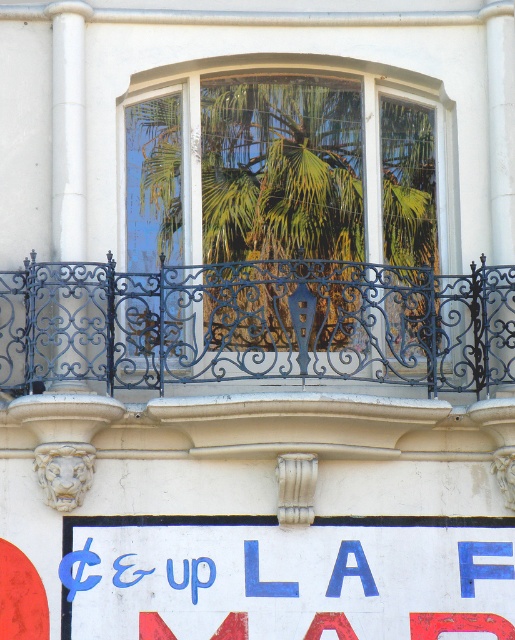
You are standing in front of the building and want to look through the clear glass window at center to see the view outside. However, the black wrought iron balcony at center is blocking your view. Can you move to a position where you can see through the window without obstruction?

The clear glass window at center is positioned over the black wrought iron balcony at center, so if you move to a position slightly above the balcony, you can look through the window without obstruction.

You are an architect reviewing the building facade. You need to determine if the clear glass window at center can accommodate a large painting that requires at least 2 meters in height. The black wrought iron balcony at center is known to be 1.5 meters tall. Can the window fit the painting?

The clear glass window at center has a greater height compared to the black wrought iron balcony at center, which is 1.5 meters tall. Since the window is taller, it can accommodate the painting requiring at least 2 meters in height.

You are a painter standing on the ground floor of the building. You want to paint both the black wrought iron balcony at center and the white painted signboard at lower center. Which object will require you to reach a higher position to paint?

The black wrought iron balcony at center is much taller than the white painted signboard at lower center, so you will need to reach a higher position to paint the black wrought iron balcony at center.